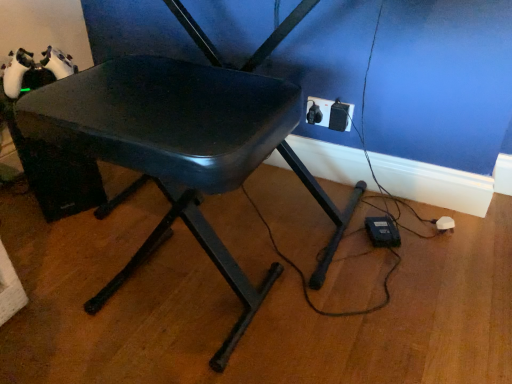
Where is `free region under matte black chair at center (from a real-world perspective)`? The width and height of the screenshot is (512, 384). free region under matte black chair at center (from a real-world perspective) is located at coordinates (180, 299).